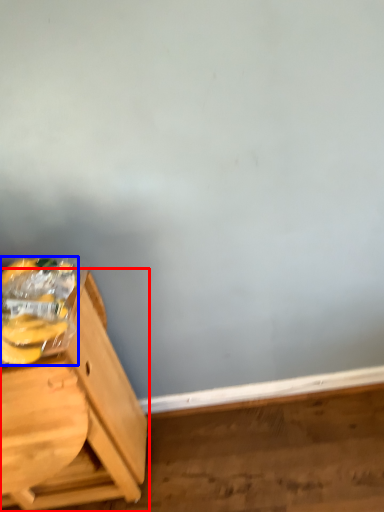
Question: Which point is further to the camera, furniture (highlighted by a red box) or banana (highlighted by a blue box)?

Choices:
 (A) furniture
 (B) banana

Answer: (A)